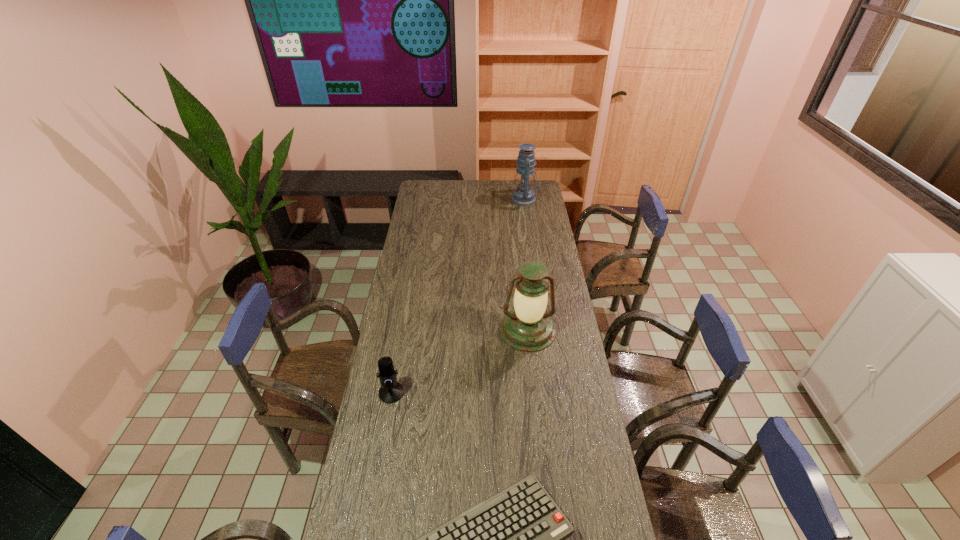
This screenshot has width=960, height=540. What are the coordinates of `the farthest object` in the screenshot? It's located at coord(523,195).

I want to click on the third nearest object, so click(x=527, y=327).

Locate an element on the screen. The height and width of the screenshot is (540, 960). microphone is located at coordinates (391, 391).

The height and width of the screenshot is (540, 960). I want to click on the second shortest object, so click(391, 391).

Where is `vacant space located on the front-facing side of the farther lantern`? vacant space located on the front-facing side of the farther lantern is located at coordinates (483, 200).

Where is `free space located on the front-facing side of the farther lantern`? free space located on the front-facing side of the farther lantern is located at coordinates (501, 200).

Find the location of a particular element. The height and width of the screenshot is (540, 960). vacant space located on the front-facing side of the farther lantern is located at coordinates (449, 200).

Locate an element on the screen. The image size is (960, 540). vacant space located with the light compartment facing forward on the second farthest object is located at coordinates (540, 441).

At what (x,y) coordinates should I click in order to perform the action: click on vacant space situated 0.050m on the stand of the second nearest object. Please return your answer as a coordinate pair (x, y). Image resolution: width=960 pixels, height=540 pixels. Looking at the image, I should click on (387, 416).

This screenshot has height=540, width=960. Identify the location of object present at the far edge. (523, 195).